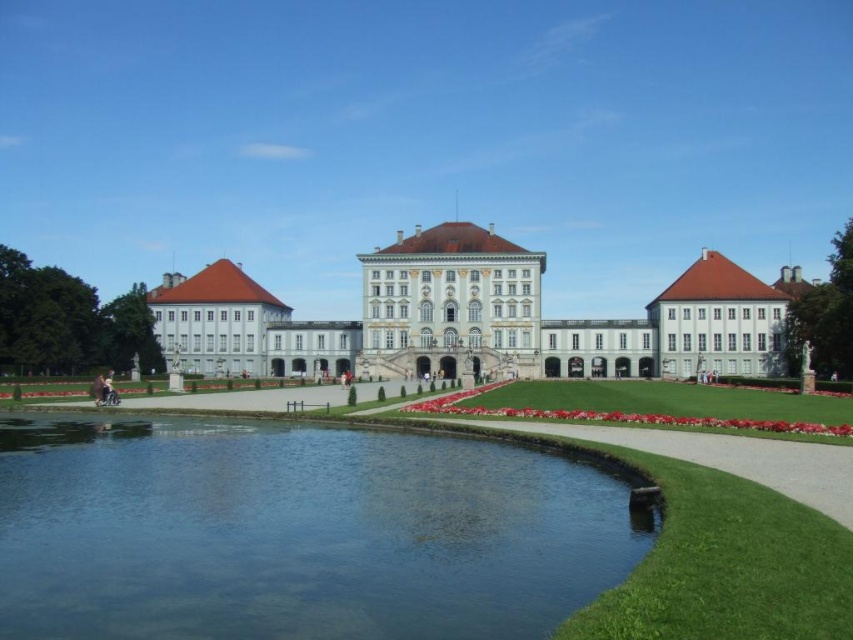
Can you confirm if clear water at bottom center is wider than white stone palace at center?

No.

Between point (413, 484) and point (459, 316), which one is positioned behind?

The point (459, 316) is behind.

The height and width of the screenshot is (640, 853). What are the coordinates of `clear water at bottom center` in the screenshot? It's located at (294, 532).